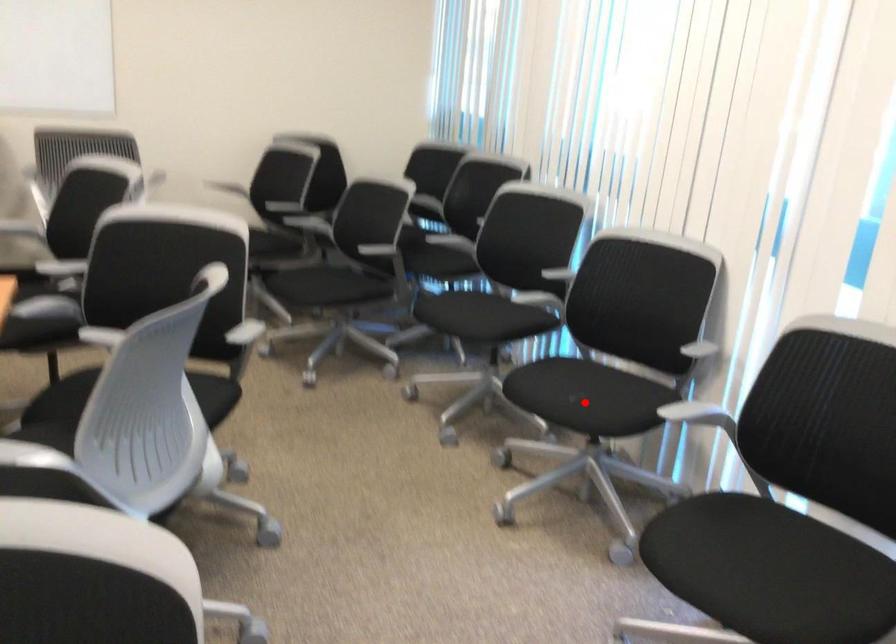
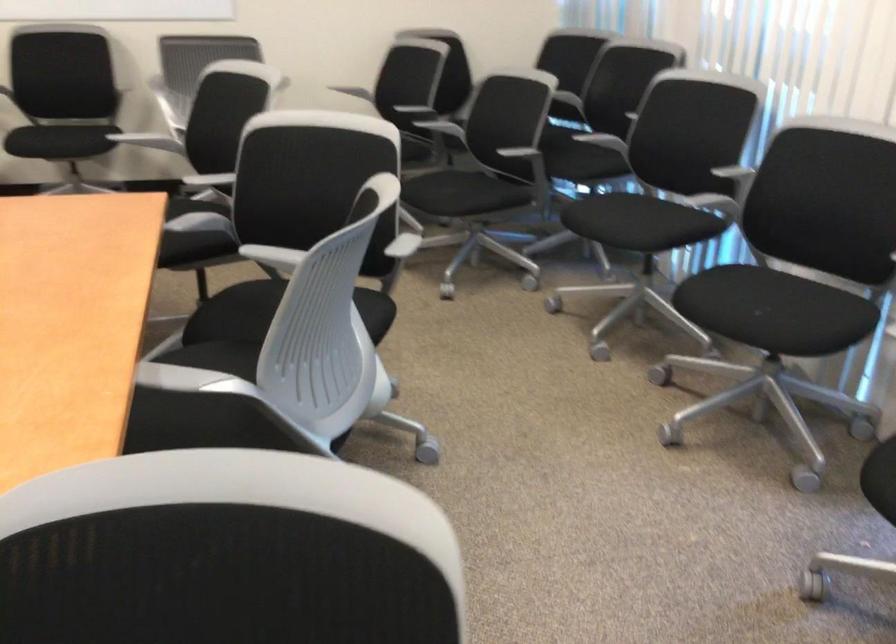
Question: I am providing you with two images of the same scene from different viewpoints. A red point is shown in image1. For the corresponding object point in image2, is it positioned nearer or farther from the camera?

Choices:
 (A) Nearer
 (B) Farther

Answer: (A)